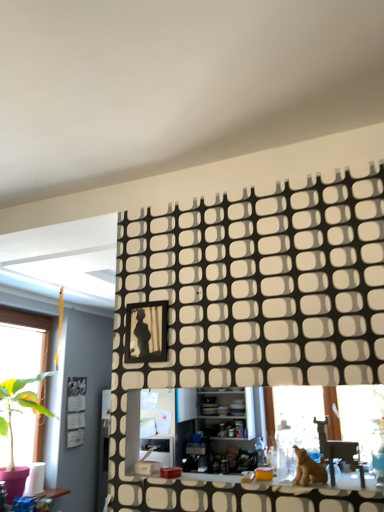
Question: Does white glossy counter top at center touch brown furry dog at lower right?

Choices:
 (A) no
 (B) yes

Answer: (A)

Question: From the image's perspective, is white glossy counter top at center located above brown furry dog at lower right?

Choices:
 (A) yes
 (B) no

Answer: (B)

Question: Considering the relative sizes of white glossy counter top at center and brown furry dog at lower right in the image provided, is white glossy counter top at center smaller than brown furry dog at lower right?

Choices:
 (A) no
 (B) yes

Answer: (B)

Question: Does white glossy counter top at center have a greater width compared to brown furry dog at lower right?

Choices:
 (A) no
 (B) yes

Answer: (B)

Question: Can you confirm if white glossy counter top at center is bigger than brown furry dog at lower right?

Choices:
 (A) no
 (B) yes

Answer: (A)

Question: In the image, is metallic silver swivel chair at lower right on the left side or the right side of white glossy counter top at center?

Choices:
 (A) left
 (B) right

Answer: (B)

Question: Considering the positions of point (332, 444) and point (256, 482), is point (332, 444) closer or farther from the camera than point (256, 482)?

Choices:
 (A) farther
 (B) closer

Answer: (B)

Question: From a real-world perspective, is metallic silver swivel chair at lower right physically located above or below white glossy counter top at center?

Choices:
 (A) above
 (B) below

Answer: (A)

Question: Is metallic silver swivel chair at lower right wider or thinner than white glossy counter top at center?

Choices:
 (A) thin
 (B) wide

Answer: (A)

Question: From the image's perspective, is brown furry dog at lower right above or below black textured wall panel at upper center?

Choices:
 (A) above
 (B) below

Answer: (B)

Question: Based on their positions, is brown furry dog at lower right located to the left or right of black textured wall panel at upper center?

Choices:
 (A) left
 (B) right

Answer: (B)

Question: Is brown furry dog at lower right situated inside black textured wall panel at upper center or outside?

Choices:
 (A) inside
 (B) outside

Answer: (B)

Question: Is point (322, 475) positioned closer to the camera than point (241, 223)?

Choices:
 (A) farther
 (B) closer

Answer: (B)

Question: From the image's perspective, is black textured wall panel at upper center positioned above or below metallic silver swivel chair at lower right?

Choices:
 (A) above
 (B) below

Answer: (A)

Question: From a real-world perspective, relative to metallic silver swivel chair at lower right, is black textured wall panel at upper center vertically above or below?

Choices:
 (A) above
 (B) below

Answer: (A)